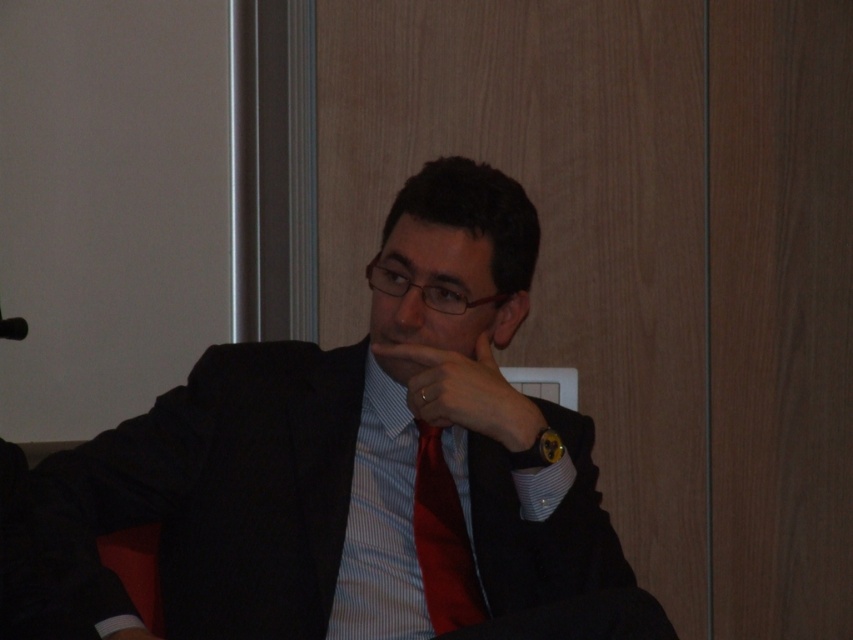
Describe the element at coordinates (380, 524) in the screenshot. I see `light blue striped dress shirt at center` at that location.

Is point (393, 570) behind point (409, 332)?

Yes, it is behind point (409, 332).

The height and width of the screenshot is (640, 853). Find the location of `light blue striped dress shirt at center`. light blue striped dress shirt at center is located at coordinates (380, 524).

Is light blue striped dress shirt at center to the left of red satin tie at center from the viewer's perspective?

Yes, light blue striped dress shirt at center is to the left of red satin tie at center.

Between light blue striped dress shirt at center and red satin tie at center, which one is positioned higher?

light blue striped dress shirt at center is above.

Which is in front, point (416, 614) or point (463, 564)?

Positioned in front is point (416, 614).

Locate an element on the screen. The width and height of the screenshot is (853, 640). light blue striped dress shirt at center is located at coordinates (380, 524).

Between matte black hand at center and matte glass nose at center, which one has more height?

matte black hand at center is taller.

Measure the distance between point (467, 385) and camera.

1.46 meters

Identify the location of matte black hand at center. (462, 392).